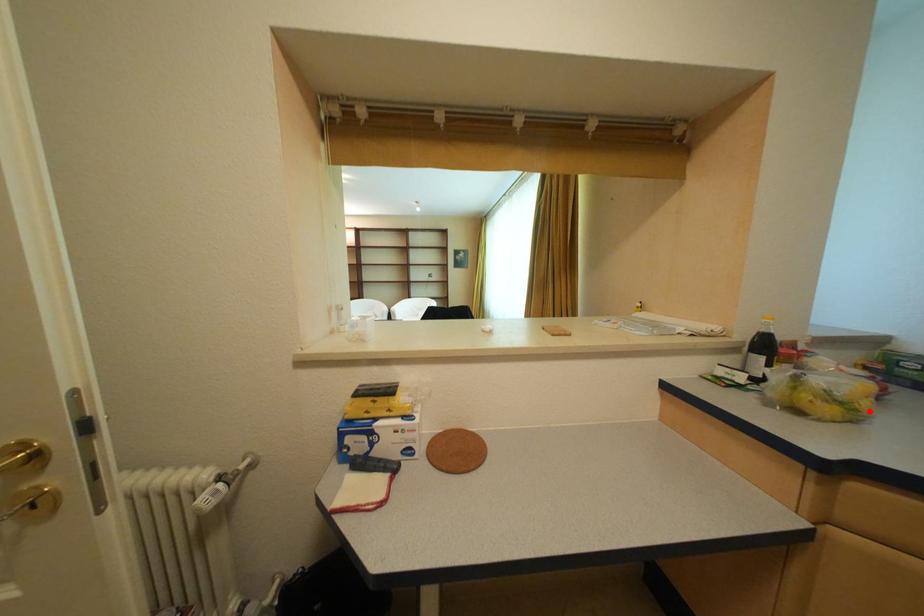
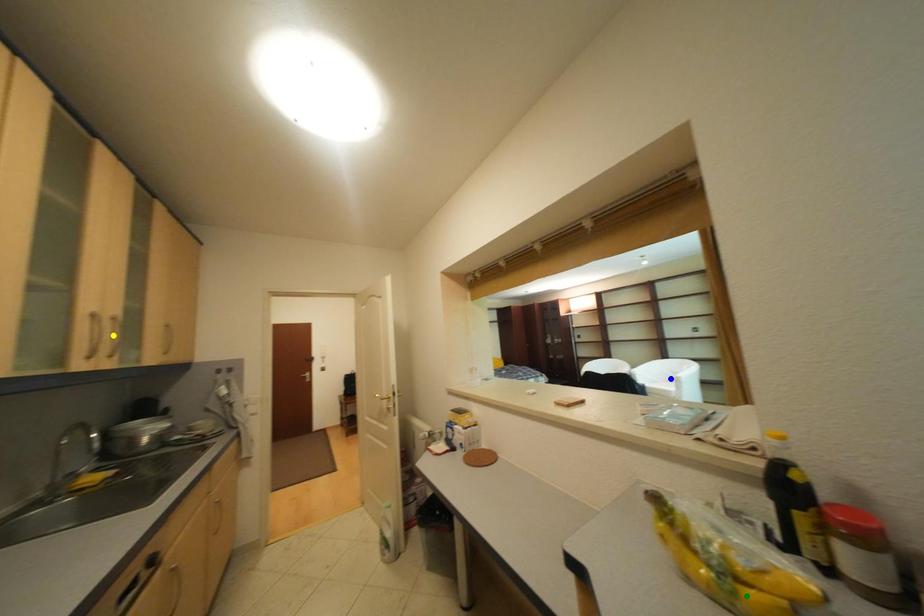
Question: I am providing you with two images of the same scene from different viewpoints. A red point is marked on the first image. You are given multiple points on the second image. Which point in image 2 represents the same 3d spot as the red point in image 1?

Choices:
 (A) green point
 (B) yellow point
 (C) blue point

Answer: (A)